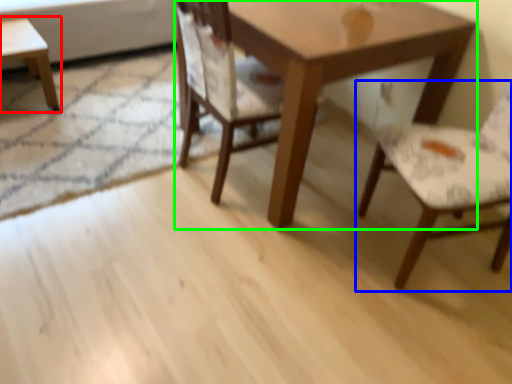
Question: Considering the real-world distances, which object is farthest from coffee table (highlighted by a red box)? chair (highlighted by a blue box) or table (highlighted by a green box)?

Choices:
 (A) chair
 (B) table

Answer: (A)